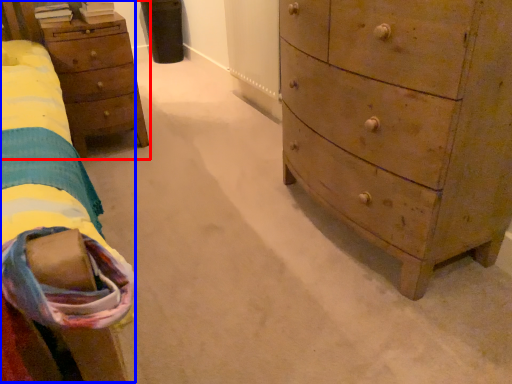
Question: Which point is closer to the camera, nightstand (highlighted by a red box) or bed (highlighted by a blue box)?

Choices:
 (A) nightstand
 (B) bed

Answer: (B)